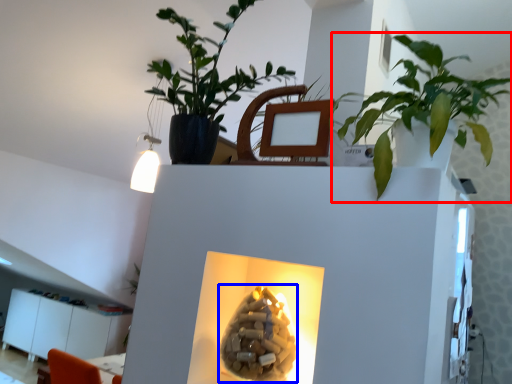
Question: Which object appears closest to the camera in this image, houseplant (highlighted by a red box) or flower (highlighted by a blue box)?

Choices:
 (A) houseplant
 (B) flower

Answer: (A)